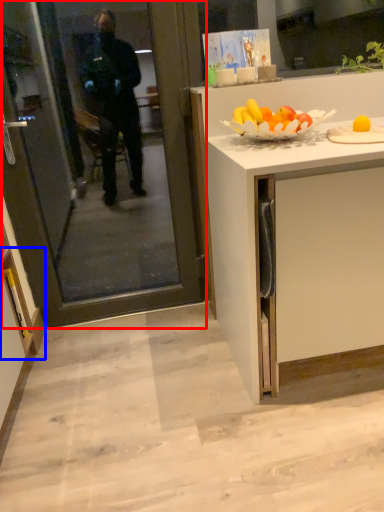
Question: Which of the following is the closest to the observer, screen door (highlighted by a red box) or cabinetry (highlighted by a blue box)?

Choices:
 (A) screen door
 (B) cabinetry

Answer: (A)